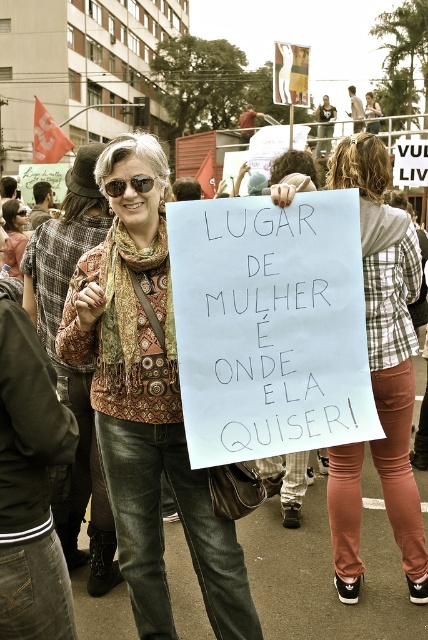
Is plaid shirt at center bigger than sunglasses at center?

Indeed, plaid shirt at center has a larger size compared to sunglasses at center.

Which of these two, plaid shirt at center or sunglasses at center, stands taller?

plaid shirt at center

The height and width of the screenshot is (640, 428). I want to click on plaid shirt at center, so (389, 337).

Locate an element on the screen. Image resolution: width=428 pixels, height=640 pixels. plaid shirt at center is located at coordinates (389, 337).

Between point (398, 486) and point (11, 266), which one is positioned in front?

Positioned in front is point (398, 486).

Which of these two, plaid shirt at center or brown leather jacket at center, stands taller?

plaid shirt at center

Is point (344, 486) positioned in front of point (20, 227)?

Yes, it is.

In order to click on plaid shirt at center in this screenshot , I will do `click(389, 337)`.

What are the coordinates of `patterned scarf at center` in the screenshot? It's located at (146, 404).

Which is below, patterned scarf at center or sunglasses at center?

Positioned lower is patterned scarf at center.

Where is `patterned scarf at center`? patterned scarf at center is located at coordinates (146, 404).